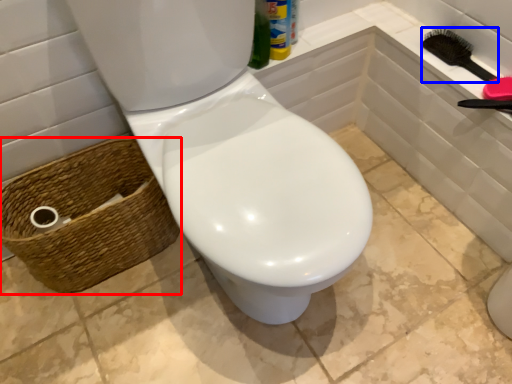
Question: Which point is closer to the camera, basket (highlighted by a red box) or brush (highlighted by a blue box)?

Choices:
 (A) basket
 (B) brush

Answer: (A)